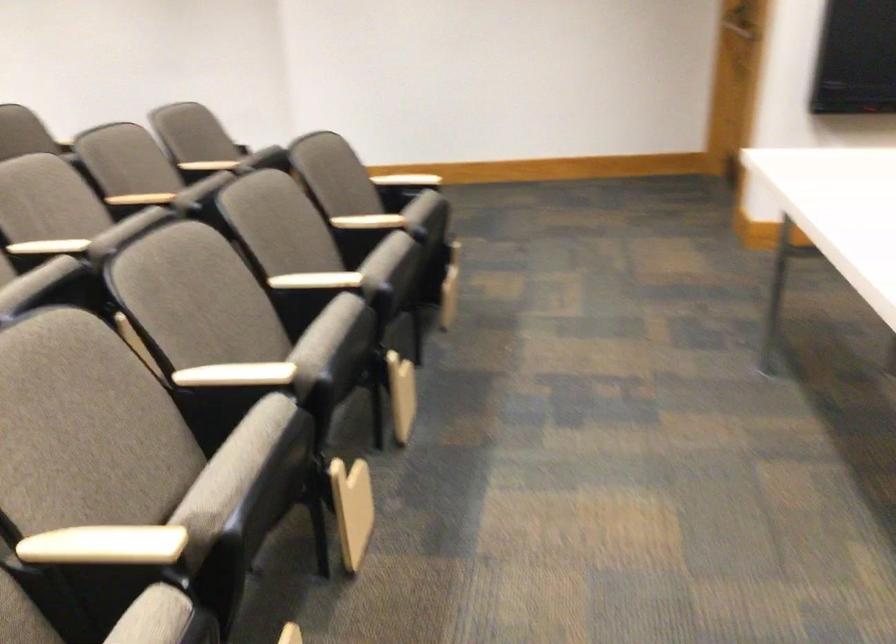
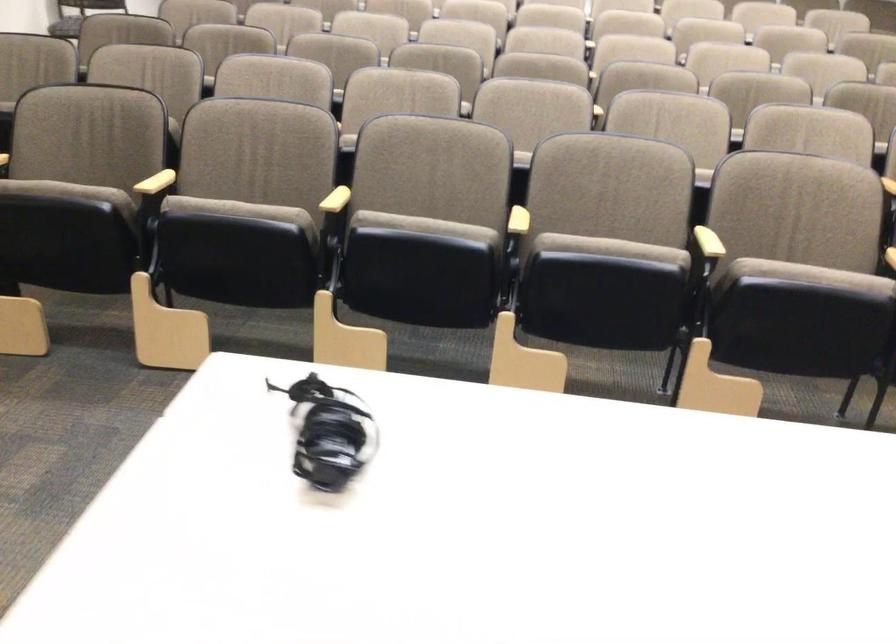
Where in the second image is the point corresponding to [317,326] from the first image?

(610, 249)